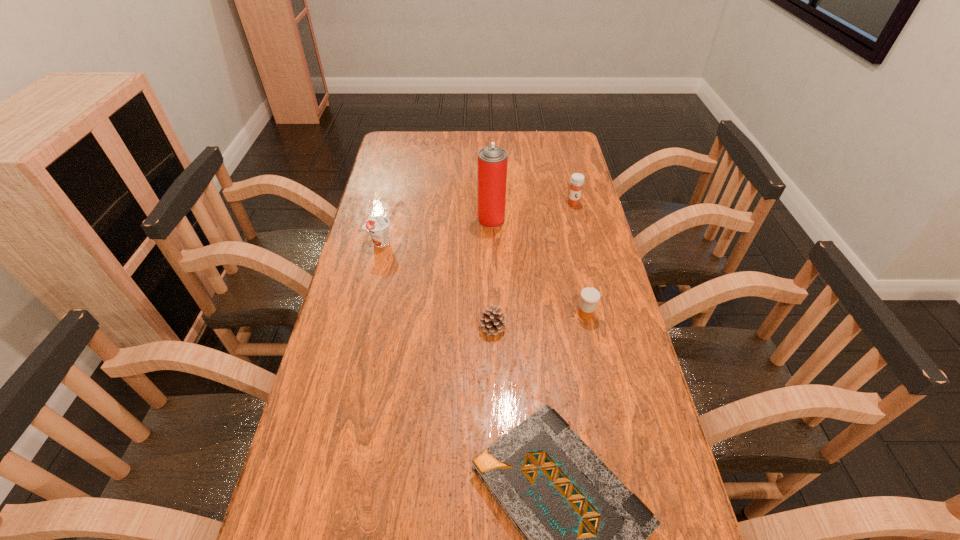
Locate an element on the screen. aerosol can is located at coordinates (492, 160).

At what (x,y) coordinates should I click in order to perform the action: click on the fifth nearest object. Please return your answer as a coordinate pair (x, y). The image size is (960, 540). Looking at the image, I should click on tap(492, 160).

This screenshot has width=960, height=540. I want to click on the farther medicine, so click(x=577, y=179).

Image resolution: width=960 pixels, height=540 pixels. In order to click on the fifth shortest object in this screenshot , I will do `click(577, 179)`.

Image resolution: width=960 pixels, height=540 pixels. I want to click on the third farthest object, so click(x=378, y=226).

The width and height of the screenshot is (960, 540). I want to click on yogurt, so click(378, 226).

Image resolution: width=960 pixels, height=540 pixels. In order to click on the nearer medicine in this screenshot , I will do `click(590, 296)`.

Where is `pinecone`? The image size is (960, 540). pinecone is located at coordinates (492, 320).

Find the location of `vacant region located on the left of the tallest object`. vacant region located on the left of the tallest object is located at coordinates (444, 220).

The width and height of the screenshot is (960, 540). In order to click on free spot located 0.310m on the label side of the fifth shortest object in this screenshot , I will do `click(588, 269)`.